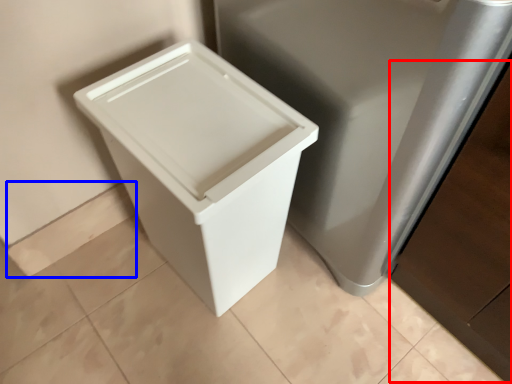
Question: Which of the following is the closest to the observer, cabinetry (highlighted by a red box) or square (highlighted by a blue box)?

Choices:
 (A) cabinetry
 (B) square

Answer: (A)